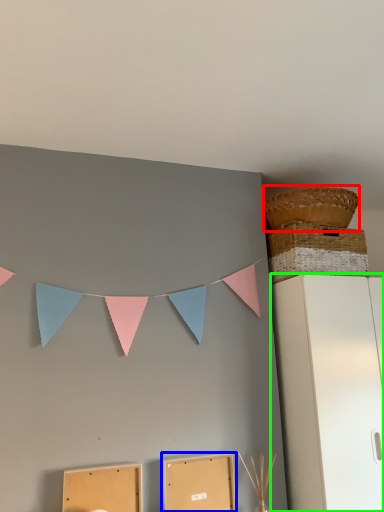
Question: Which object is positioned farthest from basket (highlighted by a red box)? Select from cardboard box (highlighted by a blue box) and furniture (highlighted by a green box).

Choices:
 (A) cardboard box
 (B) furniture

Answer: (A)